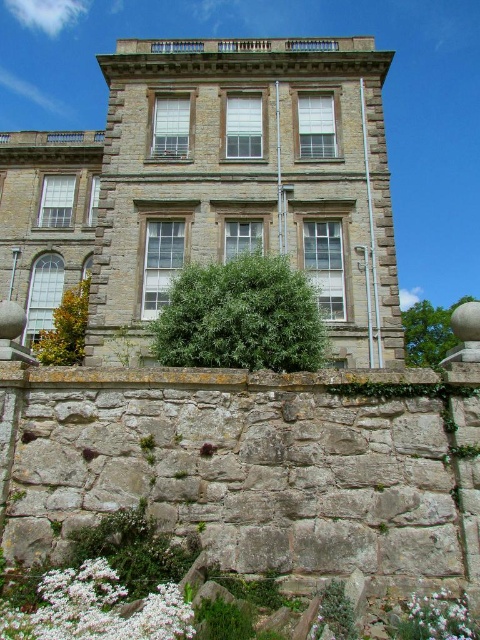
You are a gardener who wants to plant two types of flowers in the garden of the grand stone building. You have a white fluffy flower at lower left and a white matte flower at lower right. Which flower should you choose if you want the taller one for the garden entrance?

You should choose the white fluffy flower at lower left because it is taller than the white matte flower at lower right.